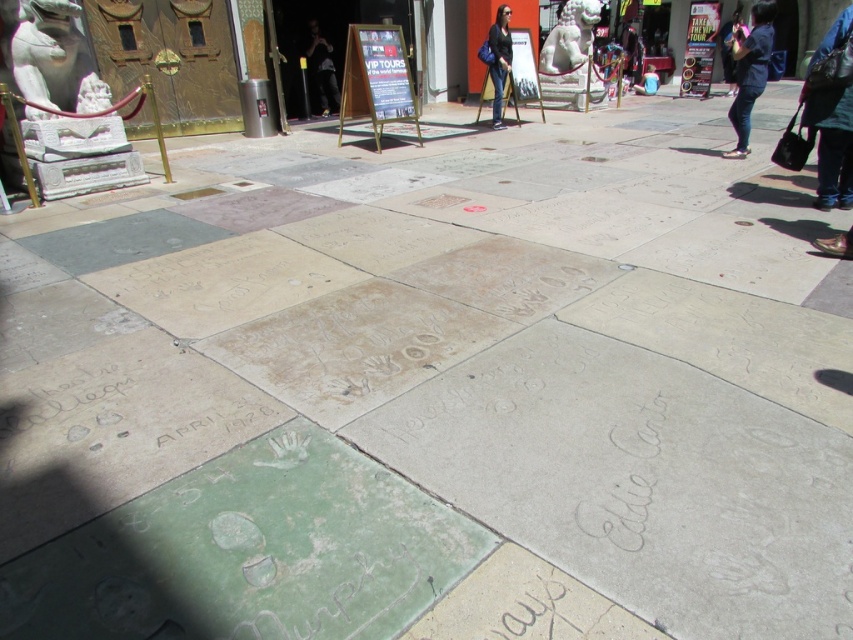
You are standing on the sidewalk and want to take a photo of the green concrete handprints at lower left. If your camera can focus on objects up to 1.5 meters away, will it be able to focus properly?

The green concrete handprints at lower left are 1.52 meters away from the viewer. Since the camera can focus up to 1.5 meters, it is just slightly out of range, so the camera may not focus properly.

You are standing at the sidewalk in front of the VIP TOURS sign and see two points marked on the pavement. The first point is at coordinates point (589,99) and the second point is at point (769,12). Which point is closer to you?

Point (589,99) is closer to you because it is further to the viewer than point (769,12).